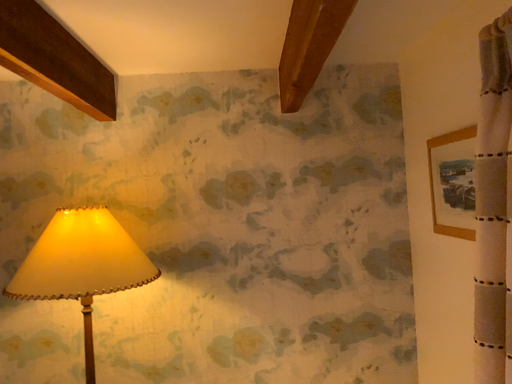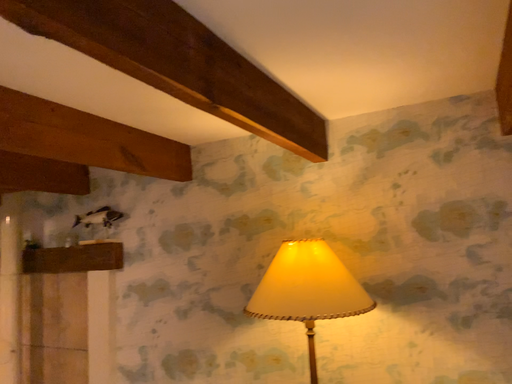
Question: How did the camera likely rotate when shooting the video?

Choices:
 (A) rotated left
 (B) rotated right

Answer: (A)